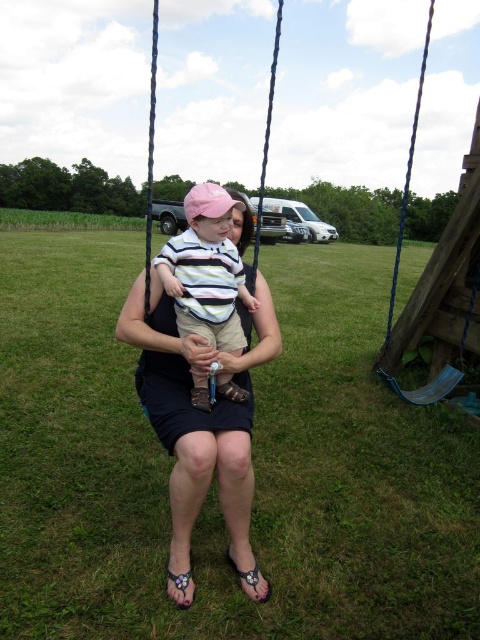
You are a photographer trying to capture the child in the striped cotton shirt at center. You notice a point at coordinates (206, 269) in the image. Is this point on the striped cotton shirt at center?

Yes, the point at coordinates (206, 269) is on the striped cotton shirt at center according to the description.

You are a photographer standing in the scene. You want to take a photo of the matte black dress at center and the wooden swing at center. Which object should you focus on first if you want to capture both in the same frame without moving the camera?

The matte black dress at center is below the wooden swing at center, so you should focus on the wooden swing at center first to ensure both are in the frame.